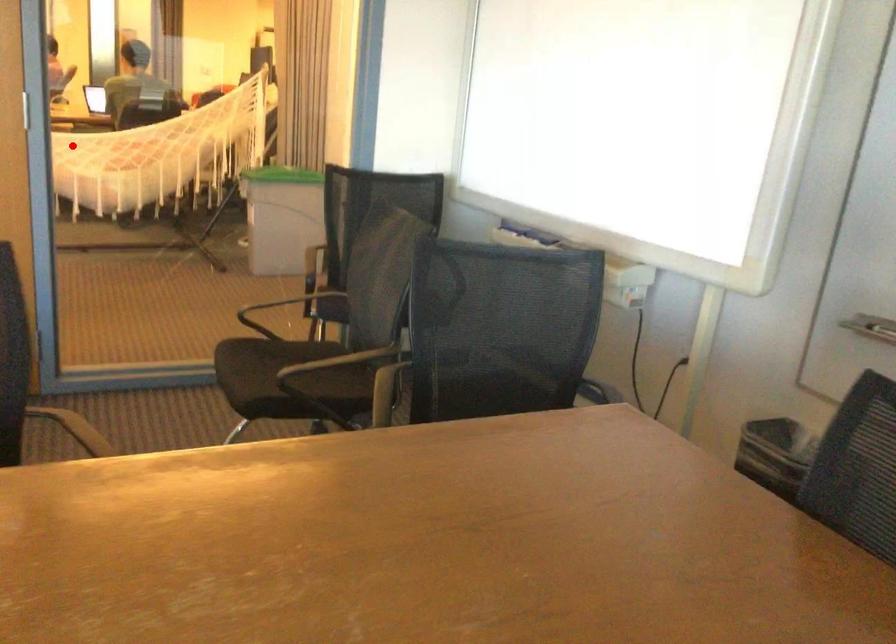
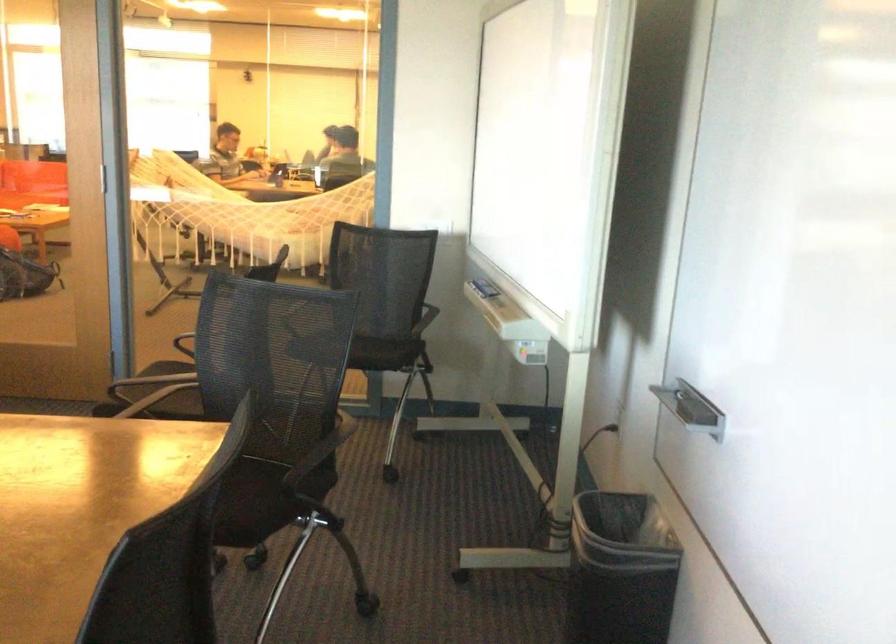
Question: I am providing you with two images of the same scene from different viewpoints. Image1 has a red point marked. In image2, the corresponding 3D location appears at what relative position? Reply with the corresponding letter.

Choices:
 (A) Closer
 (B) Farther

Answer: (B)